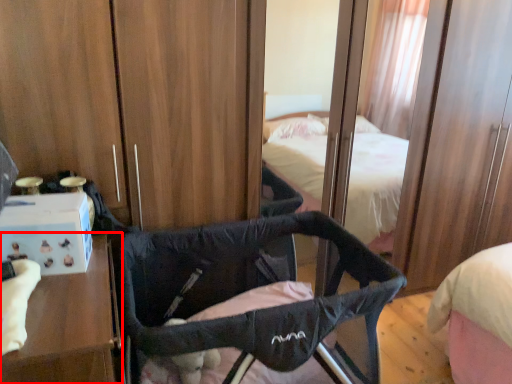
Question: From the image's perspective, where is furniture (annotated by the red box) located relative to infant bed?

Choices:
 (A) below
 (B) above

Answer: (A)